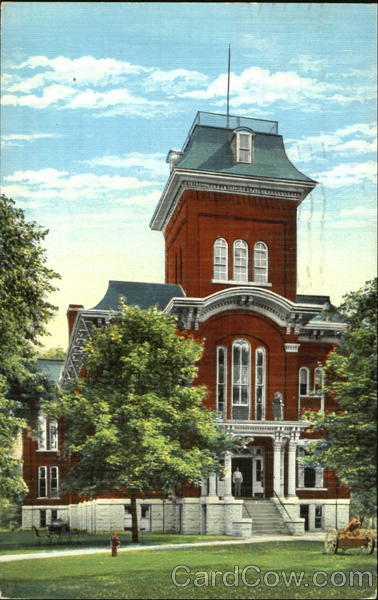
The height and width of the screenshot is (600, 378). I want to click on entrance, so click(244, 468).